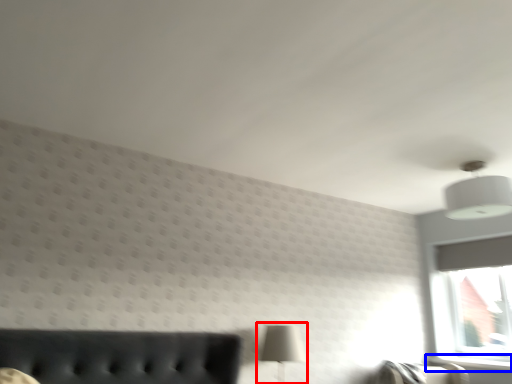
Question: Which point is closer to the camera, table lamp (highlighted by a red box) or window sill (highlighted by a blue box)?

Choices:
 (A) table lamp
 (B) window sill

Answer: (A)